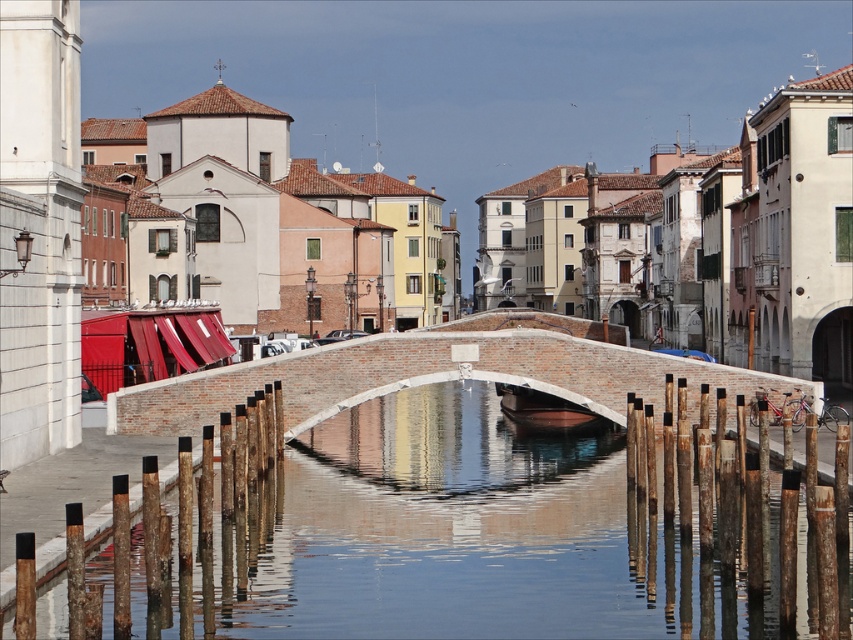
Can you confirm if white brick bridge at center is positioned above brown wooden boat at center?

Yes.

Is the position of white brick bridge at center more distant than that of brown wooden boat at center?

No, white brick bridge at center is in front of brown wooden boat at center.

Measure the distance between white brick bridge at center and camera.

white brick bridge at center is 103.75 meters away from camera.

At what (x,y) coordinates should I click in order to perform the action: click on white brick bridge at center. Please return your answer as a coordinate pair (x, y). This screenshot has height=640, width=853. Looking at the image, I should click on (433, 374).

Does clear water at bridge center lie behind brown wooden boat at center?

No, clear water at bridge center is closer to the viewer.

Measure the distance between clear water at bridge center and camera.

The distance of clear water at bridge center from camera is 60.72 meters.

Image resolution: width=853 pixels, height=640 pixels. Identify the location of clear water at bridge center. (457, 538).

Based on the photo, does clear water at bridge center appear over white brick bridge at center?

Incorrect, clear water at bridge center is not positioned above white brick bridge at center.

Consider the image. Is clear water at bridge center smaller than white brick bridge at center?

No, clear water at bridge center is not smaller than white brick bridge at center.

Find the location of a particular element. The height and width of the screenshot is (640, 853). clear water at bridge center is located at coordinates (457, 538).

You are a GUI agent. You are given a task and a screenshot of the screen. Output one action in this format:
    pyautogui.click(x=<x>, y=<y>)
    Task: Click on the clear water at bridge center
    
    Given the screenshot: What is the action you would take?
    tap(457, 538)